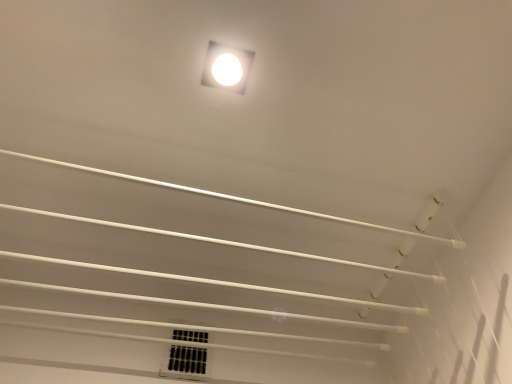
Find the location of a particular element. Image resolution: width=512 pixels, height=384 pixels. white plastic vent at lower center is located at coordinates (185, 362).

Describe the element at coordinates (185, 362) in the screenshot. I see `white plastic vent at lower center` at that location.

The width and height of the screenshot is (512, 384). Find the location of `white glossy square at upper center`. white glossy square at upper center is located at coordinates (227, 68).

What is the approximate height of white glossy square at upper center?

1.05 centimeters.

The width and height of the screenshot is (512, 384). What do you see at coordinates (227, 68) in the screenshot?
I see `white glossy square at upper center` at bounding box center [227, 68].

At what (x,y) coordinates should I click in order to perform the action: click on white plastic vent at lower center. Please return your answer as a coordinate pair (x, y). The height and width of the screenshot is (384, 512). Looking at the image, I should click on (185, 362).

Is white glossy square at upper center at the right side of white plastic vent at lower center?

Yes.

Considering the relative positions of white glossy square at upper center and white plastic vent at lower center in the image provided, is white glossy square at upper center behind white plastic vent at lower center?

No, white glossy square at upper center is in front of white plastic vent at lower center.

Which is farther, [209,48] or [170,363]?

Positioned behind is point [170,363].

From the image's perspective, is white glossy square at upper center above or below white plastic vent at lower center?

Clearly, from the image's perspective, white glossy square at upper center is above white plastic vent at lower center.

Looking at this image, from a real-world perspective, which object stands above the other?

In real-world perspective, white glossy square at upper center is above.

Which of these two, white glossy square at upper center or white plastic vent at lower center, is wider?

white glossy square at upper center.

Consider the image. Which of these two, white glossy square at upper center or white plastic vent at lower center, stands shorter?

white glossy square at upper center is shorter.

Which of these two, white glossy square at upper center or white plastic vent at lower center, is smaller?

white glossy square at upper center.

Is white glossy square at upper center spatially inside white plastic vent at lower center, or outside of it?

white glossy square at upper center is not enclosed by white plastic vent at lower center.

Is white glossy square at upper center with white plastic vent at lower center?

No, white glossy square at upper center is not touching white plastic vent at lower center.

Is white glossy square at upper center oriented towards white plastic vent at lower center?

No, white glossy square at upper center is not aimed at white plastic vent at lower center.

How different are the orientations of white glossy square at upper center and white plastic vent at lower center in degrees?

2.12 degrees.

Find the location of a particular element. Image resolution: width=512 pixels, height=384 pixels. lamp above the white plastic vent at lower center (from a real-world perspective) is located at coordinates (227, 68).

Consider the image. Which object is positioned more to the left, white plastic vent at lower center or white glossy square at upper center?

white plastic vent at lower center.

Is white plastic vent at lower center in front of or behind white glossy square at upper center in the image?

Visually, white plastic vent at lower center is located behind white glossy square at upper center.

Is point (190, 373) behind point (211, 58)?

Yes, point (190, 373) is behind point (211, 58).

From the image's perspective, is white plastic vent at lower center located beneath white glossy square at upper center?

Indeed, from the image's perspective, white plastic vent at lower center is shown beneath white glossy square at upper center.

From a real-world perspective, which is physically below, white plastic vent at lower center or white glossy square at upper center?

From a 3D spatial view, white plastic vent at lower center is below.

Can you confirm if white plastic vent at lower center is wider than white glossy square at upper center?

No.

Consider the image. Who is taller, white plastic vent at lower center or white glossy square at upper center?

With more height is white plastic vent at lower center.

In the scene shown: Looking at the image, does white plastic vent at lower center seem bigger or smaller compared to white glossy square at upper center?

In the image, white plastic vent at lower center appears to be larger than white glossy square at upper center.

Could white glossy square at upper center be considered to be inside white plastic vent at lower center?

No, white glossy square at upper center is not a part of white plastic vent at lower center.

Is white plastic vent at lower center far away from white glossy square at upper center?

white plastic vent at lower center is actually quite close to white glossy square at upper center.

Is white plastic vent at lower center aimed at white glossy square at upper center?

Yes, white plastic vent at lower center faces towards white glossy square at upper center.

Locate an element on the screen. window below the white glossy square at upper center (from the image's perspective) is located at coordinates (185, 362).

Where is `window that is on the left side of white glossy square at upper center`? This screenshot has width=512, height=384. window that is on the left side of white glossy square at upper center is located at coordinates (185, 362).

I want to click on lamp on the right of the white plastic vent at lower center, so click(227, 68).